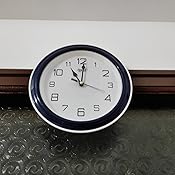
Where is `clock`? This screenshot has height=175, width=175. clock is located at coordinates (88, 97).